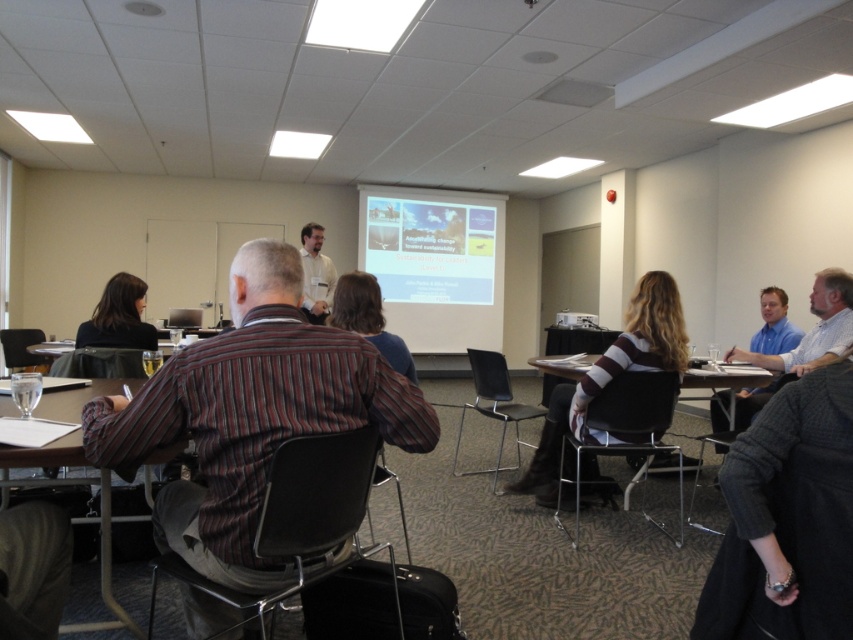
Based on the photo, you are standing in the conference room and want to reach a specific point marked as point (73, 628). If you take a step forward, will you be closer to or farther from this point?

The point (73, 628) is 7.21 feet away from viewer. Taking a step forward will decrease the distance, so you will be closer to the point (73, 628).

You are an event organizer who needs to adjust the seating arrangement in the conference room. You notice the striped sweater at center and the white plastic projector at center. Which object should you avoid placing a tall standing desk in front of to ensure visibility for attendees?

You should avoid placing a tall standing desk in front of the striped sweater at center because it is much taller than the white plastic projector at center, so blocking it would obstruct the view for attendees.

You are a guest at the conference and need to place your laptop on the wooden table at lower left. Considering the height of the table compared to the white shirt at center, will you have to bend down to place your laptop?

The wooden table at lower left is not as tall as white shirt at center, so you will have to bend down to place your laptop on the wooden table at lower left.